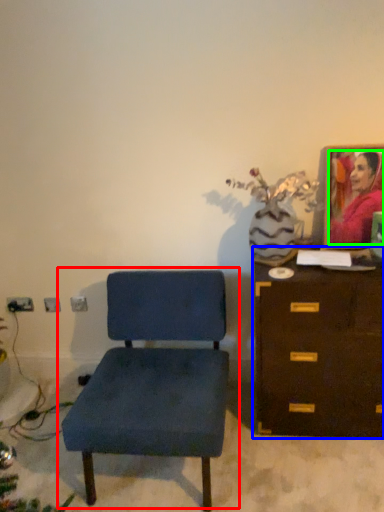
Question: Which object is the farthest from chair (highlighted by a red box)? Choose among these: chest of drawers (highlighted by a blue box) or person (highlighted by a green box).

Choices:
 (A) chest of drawers
 (B) person

Answer: (B)